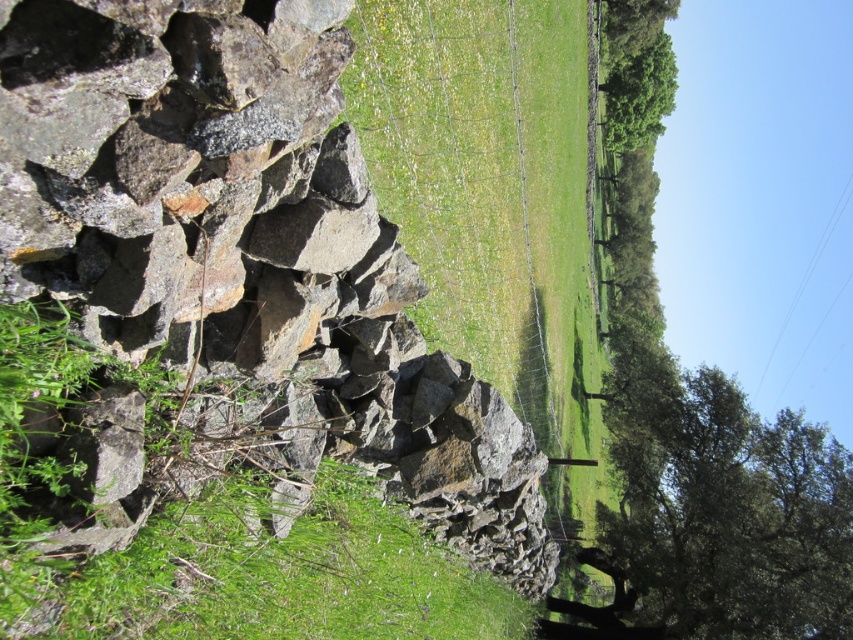
You are a gardener planning to plant new flowers in the green grassy field at center and the green leafy tree at right. Which area has more space available for planting?

The green grassy field at center has a larger size compared to the green leafy tree at right, so there is more space available for planting in the green grassy field at center.

You are standing in the rural landscape and want to walk from the green grassy field at center to the green leafy tree at right. Which direction should you move to get closer to the tree?

Since the green grassy field at center is closer to the viewer than the green leafy tree at right, you should move forward away from the viewer to reach the green leafy tree at right.

You are standing at the origin point in the image. Which direction should you move to reach the green grassy field at center?

The green grassy field at center is located at point 0.298 on the x and 0.574 on the y, so you should move towards the center of the image to reach it.